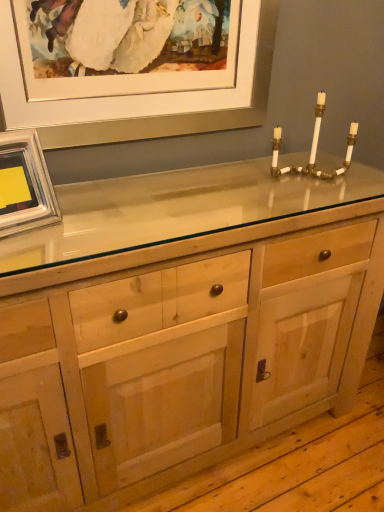
This screenshot has width=384, height=512. Find the location of `free region on the left part of white ceramic candle holder at upper right`. free region on the left part of white ceramic candle holder at upper right is located at coordinates (249, 180).